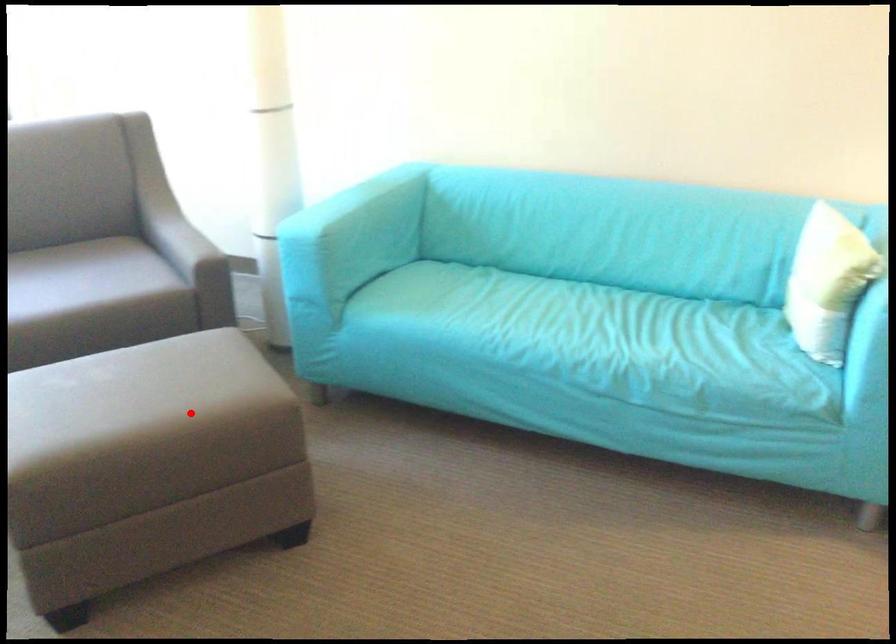
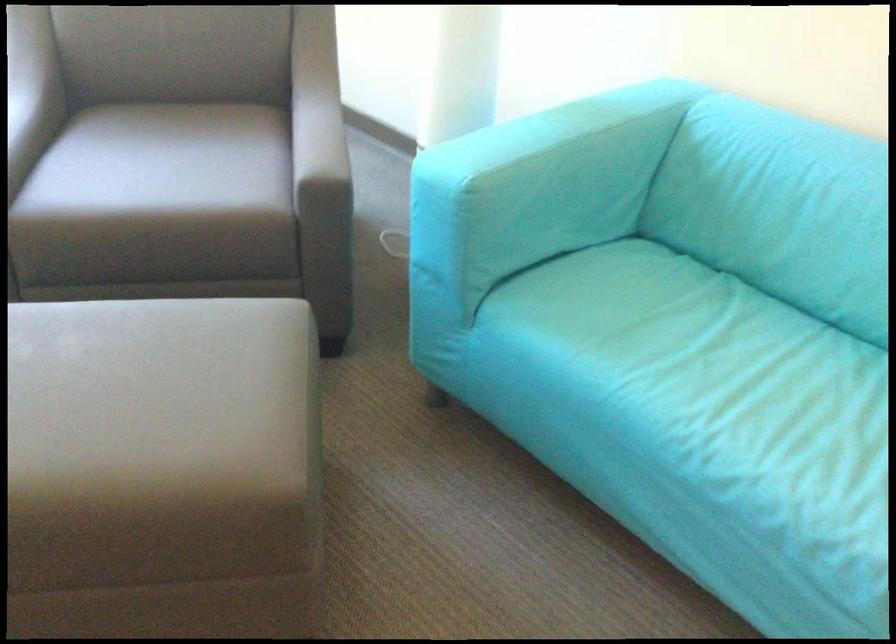
Locate, in the second image, the point that corresponds to the highlighted location in the first image.

(162, 469)